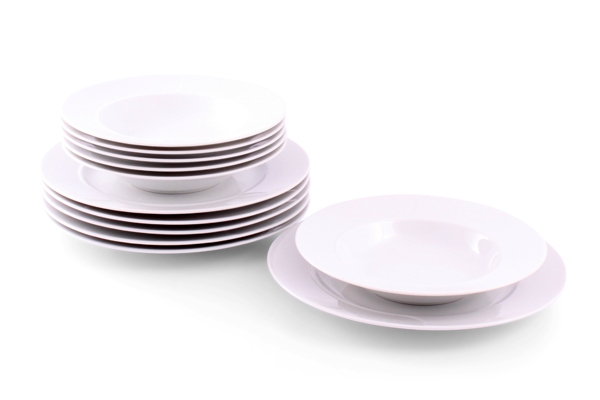
The width and height of the screenshot is (600, 400). I want to click on plates, so click(x=169, y=212), click(x=169, y=223), click(x=166, y=230), click(x=166, y=240), click(x=169, y=248), click(x=379, y=322).